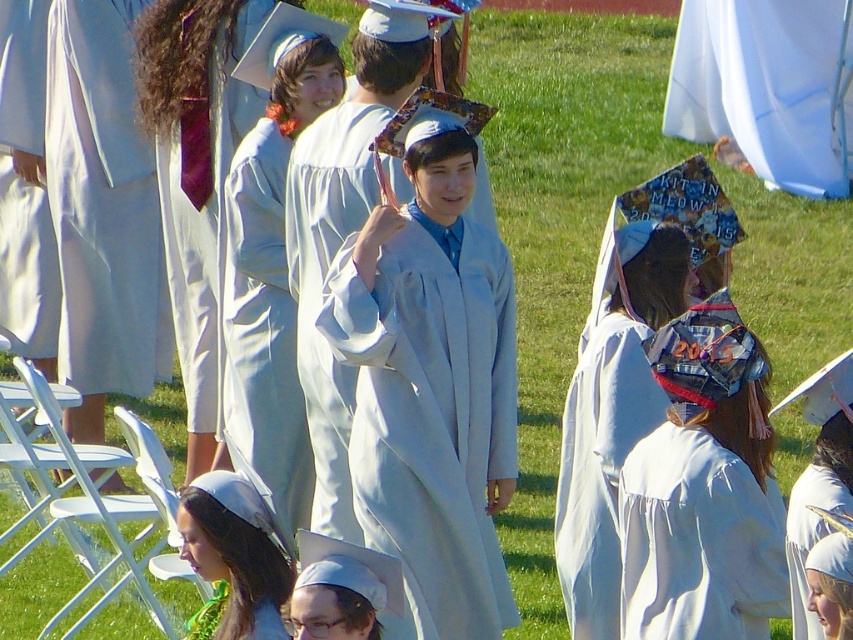
You are a photographer at the graduation ceremony. You want to take a photo of the white matte graduation cap at lower center without the light blue fabric gown at center blocking it. Is this possible based on their positions?

The white matte graduation cap at lower center is behind the light blue fabric gown at center, so it is currently blocked by the gown. To capture the cap without obstruction, you would need to adjust the angle or move closer to ensure the gown is not in front of it.

You are a photographer at the graduation ceremony and need to capture a clear shot of both the denim graduation cap at center and the white satin graduation cap at lower left. Given their sizes, which cap will appear bigger in the photo?

The denim graduation cap at center will appear bigger in the photo because it is larger in size than the white satin graduation cap at lower left.